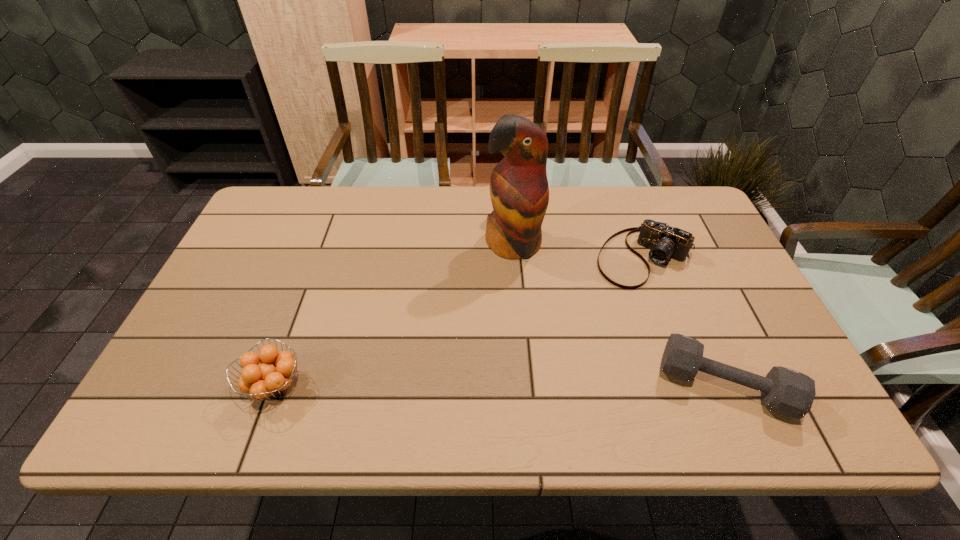
I want to click on vacant point located on the front-facing side of the camera, so click(x=584, y=339).

This screenshot has width=960, height=540. I want to click on free spot located on the front-facing side of the camera, so click(571, 355).

At what (x,y) coordinates should I click in order to perform the action: click on free spot located on the front-facing side of the camera. Please return your answer as a coordinate pair (x, y). Looking at the image, I should click on (564, 367).

Image resolution: width=960 pixels, height=540 pixels. Identify the location of parrot situated at the far edge. (519, 190).

The image size is (960, 540). I want to click on camera present at the far edge, so click(665, 242).

What are the coordinates of `orange fruit present at the near edge` in the screenshot? It's located at (273, 376).

Locate an element on the screen. Image resolution: width=960 pixels, height=540 pixels. dumbbell present at the near edge is located at coordinates pyautogui.click(x=784, y=391).

Image resolution: width=960 pixels, height=540 pixels. Identify the location of dumbbell located in the right edge section of the desktop. (784, 391).

This screenshot has width=960, height=540. What are the coordinates of `camera that is at the right edge` in the screenshot? It's located at (665, 242).

Locate an element on the screen. The width and height of the screenshot is (960, 540). object that is at the far right corner is located at coordinates (665, 242).